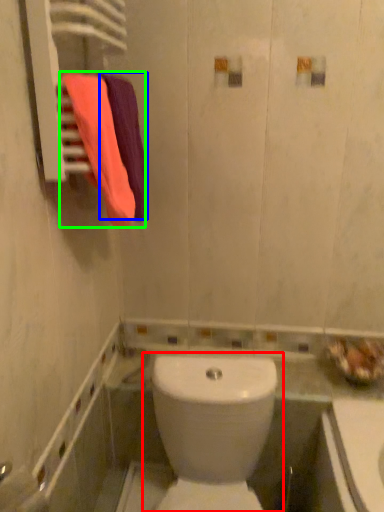
Question: Which object is the closest to the toilet (highlighted by a red box)? Choose among these: bath towel (highlighted by a blue box) or bath towel (highlighted by a green box).

Choices:
 (A) bath towel
 (B) bath towel

Answer: (B)